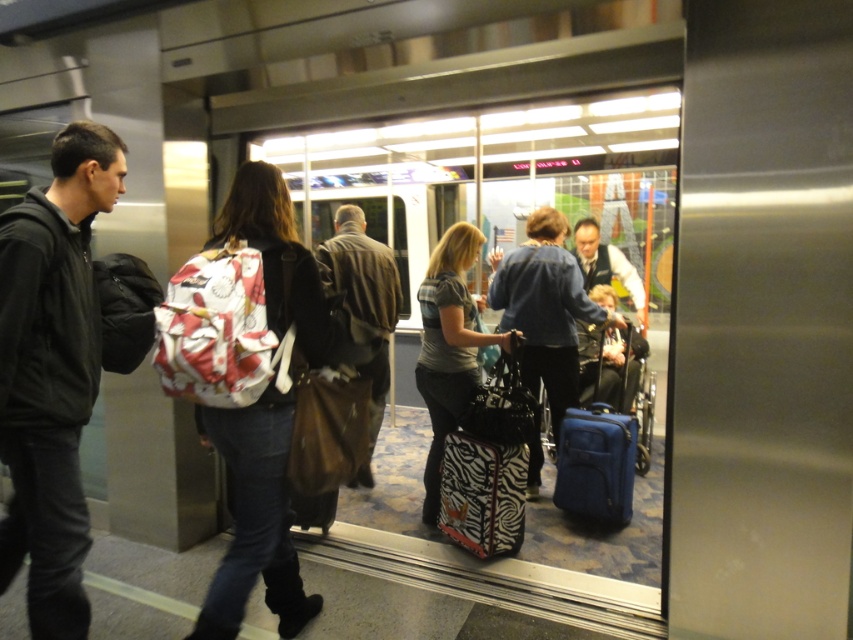
Is blue fabric suitcase at center thinner than brown leather jacket at center?

In fact, blue fabric suitcase at center might be wider than brown leather jacket at center.

Is blue fabric suitcase at center wider than brown leather jacket at center?

Indeed, blue fabric suitcase at center has a greater width compared to brown leather jacket at center.

Is point (611, 417) positioned behind point (338, 284)?

No, (611, 417) is closer to viewer.

Where is `blue fabric suitcase at center`? blue fabric suitcase at center is located at coordinates (596, 456).

Is the position of brown leather jacket at center more distant than that of blue fabric wheelchair at center?

No, it is not.

Between point (358, 248) and point (646, 342), which one is positioned in front?

Point (358, 248) is more forward.

Is point (369, 429) in front of point (585, 397)?

That is True.

At what (x,y) coordinates should I click in order to perform the action: click on brown leather jacket at center. Please return your answer as a coordinate pair (x, y). The height and width of the screenshot is (640, 853). Looking at the image, I should click on (360, 269).

Is zebra-patterned suitcase at center thinner than brown leather jacket at center?

No.

Can you confirm if zebra-patterned suitcase at center is positioned to the right of brown leather jacket at center?

Indeed, zebra-patterned suitcase at center is positioned on the right side of brown leather jacket at center.

The width and height of the screenshot is (853, 640). I want to click on zebra-patterned suitcase at center, so click(488, 465).